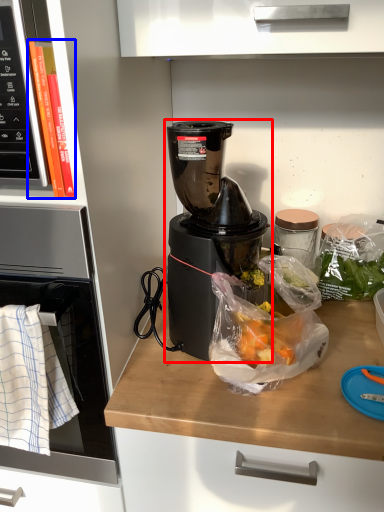
Question: Which object appears closest to the camera in this image, blender (highlighted by a red box) or book (highlighted by a blue box)?

Choices:
 (A) blender
 (B) book

Answer: (B)